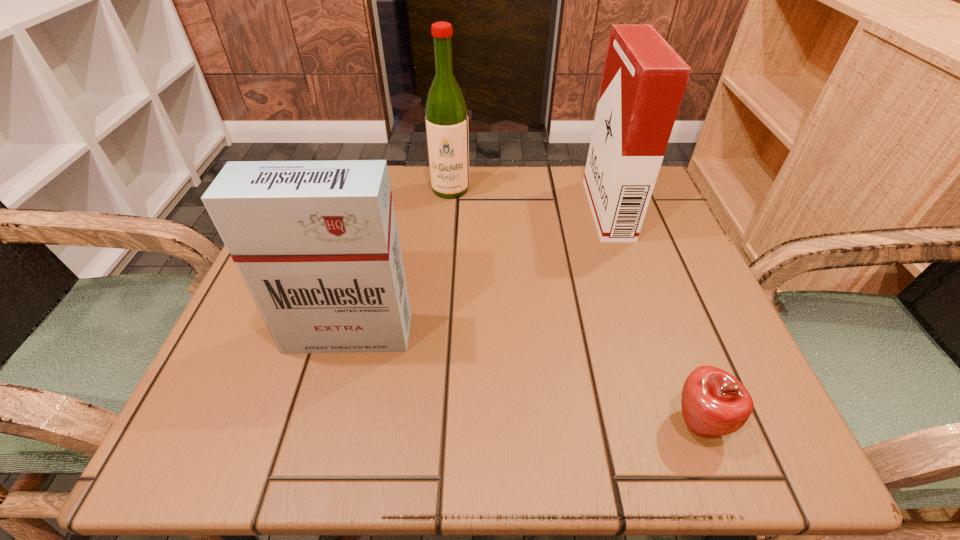
Where is `vacant region at the far edge`? vacant region at the far edge is located at coordinates (521, 226).

In the image, there is a desktop. Where is `free space at the near edge`? free space at the near edge is located at coordinates (528, 426).

In the image, there is a desktop. Identify the location of free space at the right edge. (697, 292).

Locate an element on the screen. The width and height of the screenshot is (960, 540). vacant area that lies between the shortest object and the right cigarette case is located at coordinates (653, 316).

Identify the location of free space between the shortest object and the liquor. (574, 306).

Where is `vacant space that is in between the second nearest object and the nearest object`? This screenshot has height=540, width=960. vacant space that is in between the second nearest object and the nearest object is located at coordinates (523, 379).

Identify the location of empty space that is in between the third farthest object and the farther cigarette case. This screenshot has width=960, height=540. point(478,271).

Locate an element on the screen. The image size is (960, 540). vacant area that lies between the farther cigarette case and the apple is located at coordinates (653, 316).

Identify the location of empty space between the left cigarette case and the shortest object. The height and width of the screenshot is (540, 960). (523, 379).

This screenshot has width=960, height=540. I want to click on vacant space in between the farther cigarette case and the liquor, so click(x=529, y=199).